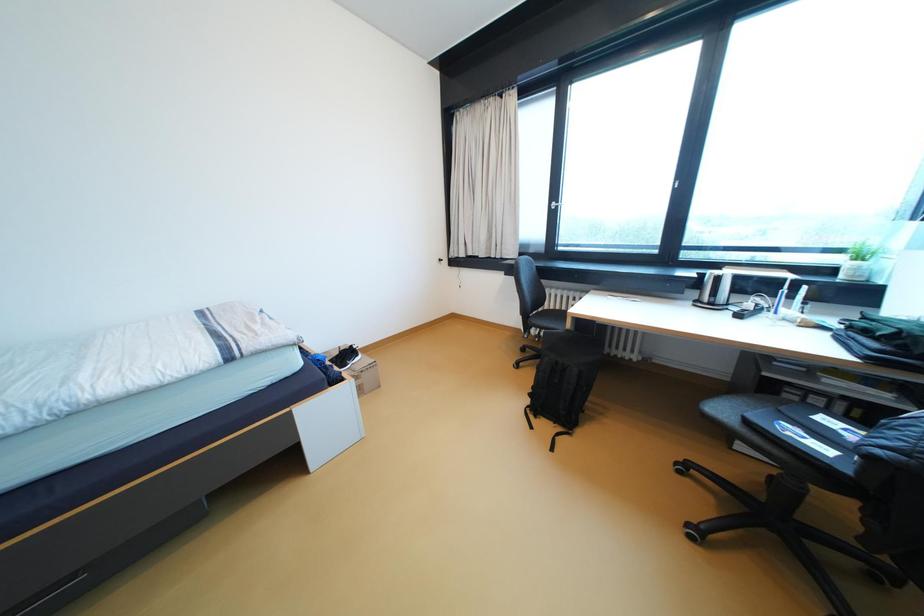
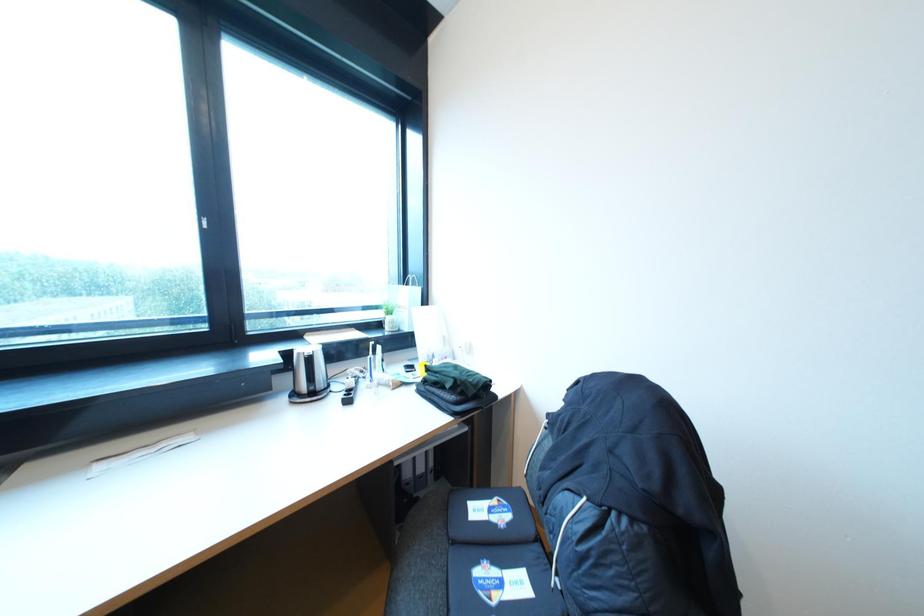
Question: The camera is either moving clockwise (left) or counter-clockwise (right) around the object. The first image is from the beginning of the video and the second image is from the end. Is the camera moving left or right when shooting the video?

Choices:
 (A) Left
 (B) Right

Answer: (A)